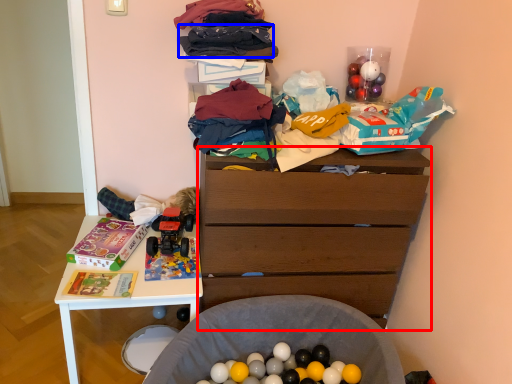
Question: Which object is further to the camera taking this photo, chest of drawers (highlighted by a red box) or clothing (highlighted by a blue box)?

Choices:
 (A) chest of drawers
 (B) clothing

Answer: (A)